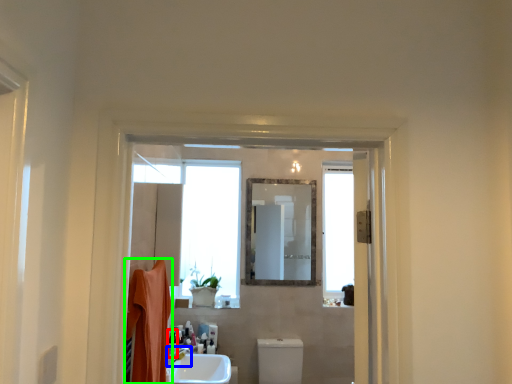
Question: Considering the real-world distances, which object is farthest from toiletry (highlighted by a red box)? tap (highlighted by a blue box) or bath towel (highlighted by a green box)?

Choices:
 (A) tap
 (B) bath towel

Answer: (B)